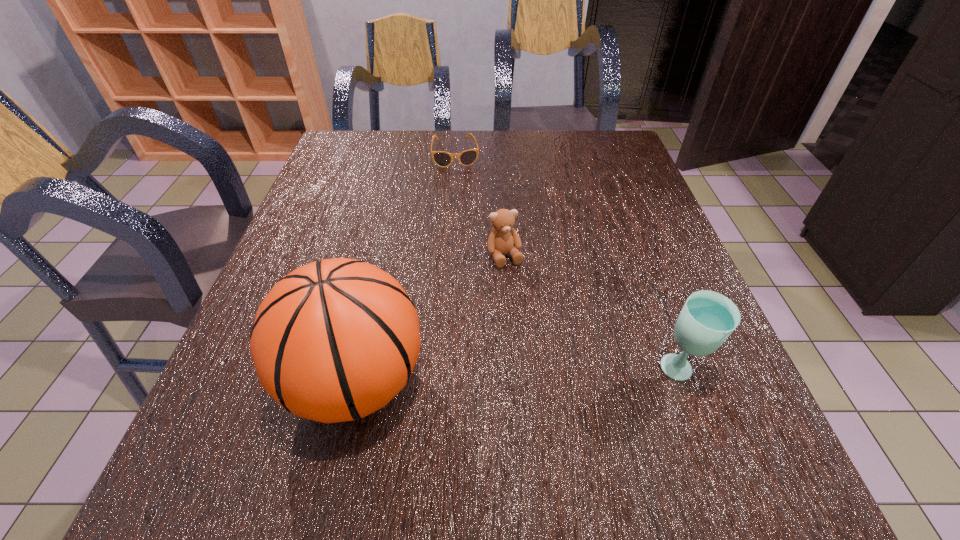
This screenshot has height=540, width=960. I want to click on basketball, so click(334, 340).

The height and width of the screenshot is (540, 960). Find the location of `glass`. glass is located at coordinates (707, 318).

At what (x,y) coordinates should I click in order to perform the action: click on the rightmost object. Please return your answer as a coordinate pair (x, y). The height and width of the screenshot is (540, 960). Looking at the image, I should click on (707, 318).

Where is `the farthest object`? the farthest object is located at coordinates (443, 159).

In order to click on sunglasses in this screenshot , I will do pyautogui.click(x=443, y=159).

Find the location of a particular element. This screenshot has height=540, width=960. the second farthest object is located at coordinates (503, 238).

Identify the location of the second shortest object. The width and height of the screenshot is (960, 540). (503, 238).

You are a GUI agent. You are given a task and a screenshot of the screen. Output one action in this format:
    pyautogui.click(x=<x>, y=<y>)
    Task: Click on the free location located 0.070m on the left of the basketball
    The image size is (960, 540).
    Given the screenshot: What is the action you would take?
    pyautogui.click(x=243, y=382)

Find the location of a particular element. Image resolution: width=960 pixels, height=540 pixels. vacant space positioned on the back of the glass is located at coordinates (653, 300).

Find the location of a particular element. The image size is (960, 540). vacant space positioned on the front-facing side of the farthest object is located at coordinates (463, 205).